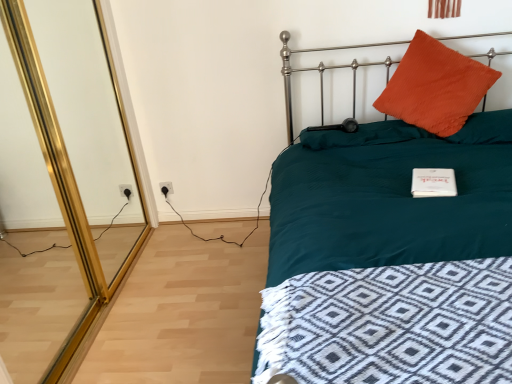
Where is `vacant region to the right of gold mirrored screen door at left`? This screenshot has width=512, height=384. vacant region to the right of gold mirrored screen door at left is located at coordinates (187, 291).